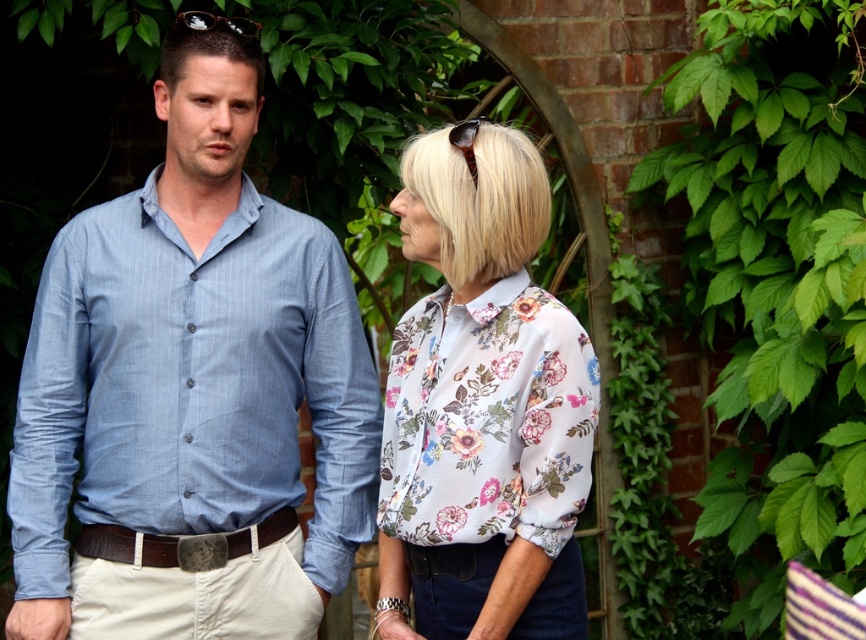
You are standing at the point with coordinates point (146, 548) and want to move to the point with coordinates point (52, 616). Which direction should you move to reach your destination?

You should move forward to reach point (52, 616) because it is in front of point (146, 548).

You are a tailor measuring the width of clothing items in the scene. You have a 30 cm wide table where you need to place the light blue cotton shirt at left and the brown leather belt at center. Which item requires more space on the table?

The light blue cotton shirt at left might be wider than brown leather belt at center, so it requires more space on the table.